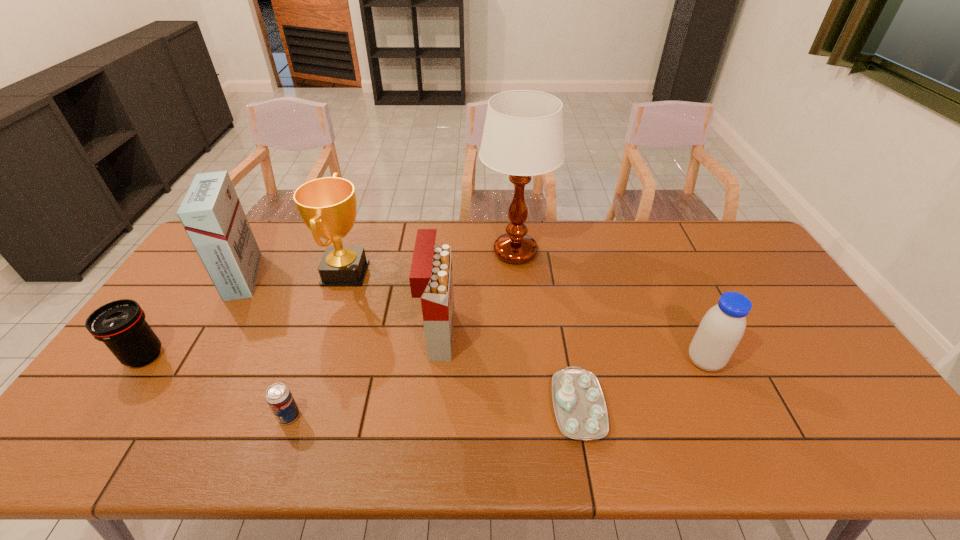
This screenshot has height=540, width=960. In order to click on table lamp present at the far edge in this screenshot , I will do click(x=523, y=136).

This screenshot has height=540, width=960. I want to click on cigarette case located in the far edge section of the desktop, so point(211,213).

Find the location of a particular element. The height and width of the screenshot is (540, 960). award that is at the far edge is located at coordinates (328, 206).

Find the location of a particular element. This screenshot has width=960, height=540. beer can that is at the near edge is located at coordinates (278, 396).

Locate an element on the screen. The height and width of the screenshot is (540, 960). chinaware situated at the near edge is located at coordinates (579, 404).

Where is `cigarette case that is at the left edge`? Image resolution: width=960 pixels, height=540 pixels. cigarette case that is at the left edge is located at coordinates (211, 213).

Identify the location of telephoto lens that is at the left edge. (120, 325).

Identify the location of object positioned at the far left corner. Image resolution: width=960 pixels, height=540 pixels. point(211,213).

The width and height of the screenshot is (960, 540). What are the coordinates of `vacant space at the far edge` in the screenshot? It's located at (694, 228).

This screenshot has width=960, height=540. In order to click on vacant area at the left edge of the desktop in this screenshot , I will do `click(175, 366)`.